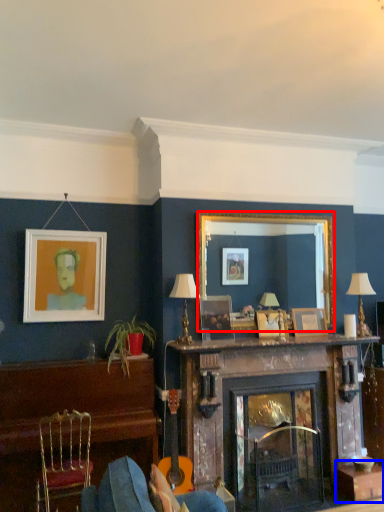
Question: Which point is further to the camera, mirror (highlighted by a red box) or table (highlighted by a blue box)?

Choices:
 (A) mirror
 (B) table

Answer: (A)